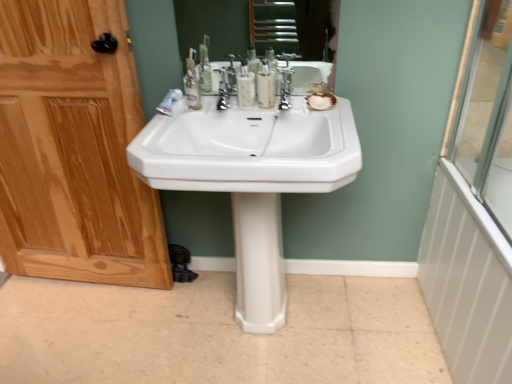
What is the approximate height of translucent plastic mouthwash at center, the first mouthwash viewed from the left?

translucent plastic mouthwash at center, the first mouthwash viewed from the left, is 15.57 centimeters in height.

You are a GUI agent. You are given a task and a screenshot of the screen. Output one action in this format:
    pyautogui.click(x=<x>, y=<y>)
    Task: Click on the translucent plastic mouthwash at center, the second mouthwash from the right
    The width and height of the screenshot is (512, 384).
    Given the screenshot: What is the action you would take?
    pyautogui.click(x=246, y=88)

Looking at this image, in order to face wooden door at left, should I rotate leftwards or rightwards?

You should rotate left by 26.182 degrees.

Where is `white glossy toothpaste at center`? The height and width of the screenshot is (384, 512). white glossy toothpaste at center is located at coordinates (169, 102).

The height and width of the screenshot is (384, 512). Identify the location of polished chrome faucet at center, which is the 2th faucet from left to right. (285, 88).

What is the approximate width of white glossy sink at center?

white glossy sink at center is 51.85 centimeters in width.

In order to face white glossy pedestal at center, should I rotate leftwards or rightwards?

You should look right and rotate roughly 0.624 degrees.

Identify the location of translucent plastic mouthwash at center, the second mouthwash from the right. (246, 88).

From a real-world perspective, does white matte shell at center sit lower than polished chrome faucet at center, which is the 2th faucet from left to right?

Indeed, from a real-world perspective, white matte shell at center is positioned beneath polished chrome faucet at center, which is the 2th faucet from left to right.

Is white matte shell at center next to polished chrome faucet at center, which is the 2th faucet from left to right, and touching it?

Absolutely, white matte shell at center is next to and touching polished chrome faucet at center, which is the 2th faucet from left to right.

Is point (324, 94) closer or farther from the camera than point (283, 76)?

Point (324, 94) appears to be farther away from the viewer than point (283, 76).

Who is taller, white matte shell at center or polished chrome faucet at center, which is the 2th faucet from left to right?

With more height is polished chrome faucet at center, which is the 2th faucet from left to right.

How many degrees apart are the facing directions of wooden door at left and translucent plastic mouthwash at center, which is the second mouthwash from left to right?

They differ by 1.05 degrees in their facing directions.

From the picture: Is wooden door at left not inside translucent plastic mouthwash at center, which ranks as the 1th mouthwash in right-to-left order?

Yes, wooden door at left is outside of translucent plastic mouthwash at center, which ranks as the 1th mouthwash in right-to-left order.

Does wooden door at left have a greater width compared to translucent plastic mouthwash at center, which ranks as the 1th mouthwash in right-to-left order?

Correct, the width of wooden door at left exceeds that of translucent plastic mouthwash at center, which ranks as the 1th mouthwash in right-to-left order.

Could you tell me if wooden door at left is facing translucent plastic mouthwash at center, which is the second mouthwash from left to right?

No, wooden door at left is not turned towards translucent plastic mouthwash at center, which is the second mouthwash from left to right.

Does wooden door at left have a greater width compared to white glossy toothpaste at center?

In fact, wooden door at left might be narrower than white glossy toothpaste at center.

Which object is positioned more to the left, wooden door at left or white glossy toothpaste at center?

wooden door at left.

From the image's perspective, is wooden door at left above white glossy toothpaste at center?

Incorrect, from the image's perspective, wooden door at left is lower than white glossy toothpaste at center.

Which of these two, translucent plastic mouthwash at center, the second mouthwash from the right, or white glossy toothpaste at center, is bigger?

With larger size is translucent plastic mouthwash at center, the second mouthwash from the right.

Is the surface of translucent plastic mouthwash at center, the first mouthwash viewed from the left, in direct contact with white glossy toothpaste at center?

No.

How many degrees apart are the facing directions of translucent plastic mouthwash at center, the second mouthwash from the right, and white glossy toothpaste at center?

translucent plastic mouthwash at center, the second mouthwash from the right, and white glossy toothpaste at center are facing 2.43 degrees away from each other.

Is point (249, 79) closer to camera compared to point (170, 101)?

Yes, it is in front of point (170, 101).

Between white glossy radiator at right and polished chrome faucet at center, which is the 2th faucet from left to right, which one has larger size?

white glossy radiator at right.

How many degrees apart are the facing directions of white glossy radiator at right and polished chrome faucet at center, the first faucet viewed from the right?

There is a 86-degree angle between the facing directions of white glossy radiator at right and polished chrome faucet at center, the first faucet viewed from the right.

From the image's perspective, between white glossy radiator at right and polished chrome faucet at center, which is the 2th faucet from left to right, which one is located above?

From the image's view, polished chrome faucet at center, which is the 2th faucet from left to right, is above.

Does white glossy radiator at right turn towards polished chrome faucet at center, which is the 2th faucet from left to right?

No, white glossy radiator at right is not aimed at polished chrome faucet at center, which is the 2th faucet from left to right.

Is white glossy sink at center at the right side of transparent glass shower door at right?

In fact, white glossy sink at center is to the left of transparent glass shower door at right.

Is white glossy sink at center further to camera compared to transparent glass shower door at right?

Yes, white glossy sink at center is further from the viewer.

From the image's perspective, relative to transparent glass shower door at right, is white glossy sink at center above or below?

white glossy sink at center is below transparent glass shower door at right.

Can you confirm if white glossy sink at center is taller than transparent glass shower door at right?

No, white glossy sink at center is not taller than transparent glass shower door at right.

From a real-world perspective, is white glossy toothpaste at center on top of white glossy sink at center?

Yes.

Is white glossy toothpaste at center further to camera compared to white glossy sink at center?

Yes, it is behind white glossy sink at center.

Between white glossy toothpaste at center and white glossy sink at center, which one has more height?

white glossy sink at center is taller.

Considering the relative positions of white glossy toothpaste at center and white glossy sink at center in the image provided, is white glossy toothpaste at center to the right of white glossy sink at center from the viewer's perspective?

In fact, white glossy toothpaste at center is to the left of white glossy sink at center.

Locate an element on the screen. This screenshot has height=384, width=512. faucet that is the 2nd one above the white matte shell at center (from a real-world perspective) is located at coordinates (285, 88).

Where is `the 2nd mouthwash to the right of the wooden door at left, starting your count from the anchor`? the 2nd mouthwash to the right of the wooden door at left, starting your count from the anchor is located at coordinates (265, 86).

Looking at the image, which one is located closer to translucent plastic mouthwash at center, which ranks as the 1th mouthwash in right-to-left order, translucent plastic mouthwash at center, the first mouthwash viewed from the left, or white glossy toothpaste at center?

translucent plastic mouthwash at center, the first mouthwash viewed from the left, is closer to translucent plastic mouthwash at center, which ranks as the 1th mouthwash in right-to-left order.

Considering their positions, is white glossy sink at center positioned further to wooden door at left than translucent plastic mouthwash at center, the first mouthwash viewed from the left?

Based on the image, translucent plastic mouthwash at center, the first mouthwash viewed from the left, appears to be further to wooden door at left.

Estimate the real-world distances between objects in this image. Which object is closer to translucent plastic mouthwash at center, which is the second mouthwash from left to right, white glossy sink at center or translucent plastic mouthwash at center, the first mouthwash viewed from the left?

translucent plastic mouthwash at center, the first mouthwash viewed from the left, lies closer to translucent plastic mouthwash at center, which is the second mouthwash from left to right, than the other object.

Estimate the real-world distances between objects in this image. Which object is further from white glossy toothpaste at center, white glossy sink at center or polished chrome faucet at center, which is counted as the 2th faucet, starting from the right?

The object further to white glossy toothpaste at center is white glossy sink at center.

Based on their spatial positions, is white matte shell at center or white glossy pedestal at center further from translucent plastic mouthwash at center, which ranks as the 1th mouthwash in right-to-left order?

Among the two, white glossy pedestal at center is located further to translucent plastic mouthwash at center, which ranks as the 1th mouthwash in right-to-left order.

Which object lies further to the anchor point white glossy pedestal at center, white glossy toothpaste at center or translucent plastic mouthwash at center, the second mouthwash from the right?

The object further to white glossy pedestal at center is white glossy toothpaste at center.

Estimate the real-world distances between objects in this image. Which object is further from translucent plastic mouthwash at center, the first mouthwash viewed from the left, polished chrome faucet at center, the first faucet viewed from the right, or polished chrome faucet at center, which ranks as the 1th faucet in left-to-right order?

The object further to translucent plastic mouthwash at center, the first mouthwash viewed from the left, is polished chrome faucet at center, the first faucet viewed from the right.

From the image, which object appears to be farther from translucent plastic mouthwash at center, which ranks as the 1th mouthwash in right-to-left order, white glossy toothpaste at center or polished chrome faucet at center, which is the 2th faucet from left to right?

The object further to translucent plastic mouthwash at center, which ranks as the 1th mouthwash in right-to-left order, is white glossy toothpaste at center.

Where is `faucet between wooden door at left and white glossy sink at center`? The width and height of the screenshot is (512, 384). faucet between wooden door at left and white glossy sink at center is located at coordinates (226, 86).

Image resolution: width=512 pixels, height=384 pixels. I want to click on mouthwash between polished chrome faucet at center, which is counted as the 2th faucet, starting from the right, and translucent plastic mouthwash at center, which is the second mouthwash from left to right, from left to right, so click(x=246, y=88).

The width and height of the screenshot is (512, 384). Find the location of `sink between translucent plastic mouthwash at center, which is the second mouthwash from left to right, and white glossy pedestal at center vertically`. sink between translucent plastic mouthwash at center, which is the second mouthwash from left to right, and white glossy pedestal at center vertically is located at coordinates (251, 145).

Where is `soap between white glossy toothpaste at center and transparent glass shower door at right`? soap between white glossy toothpaste at center and transparent glass shower door at right is located at coordinates (321, 101).